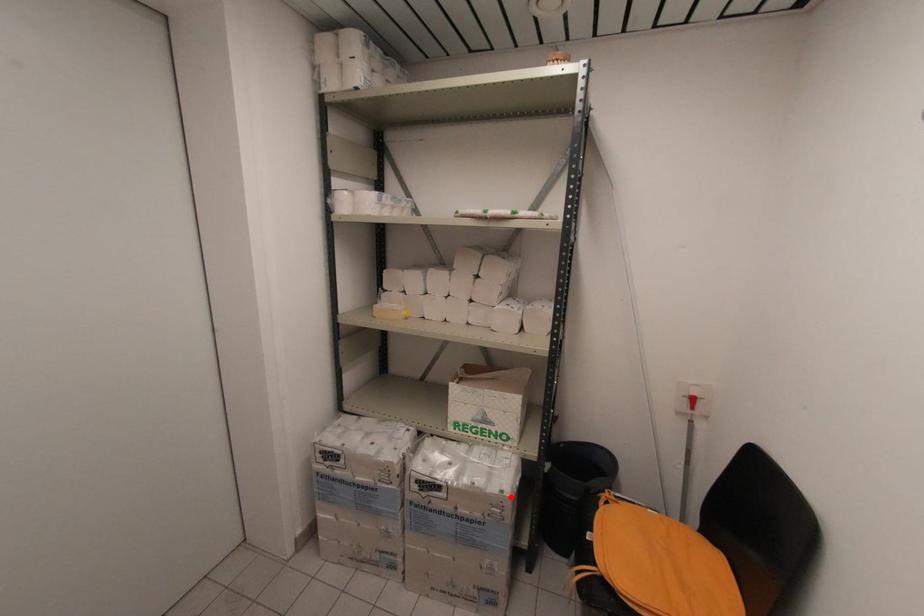
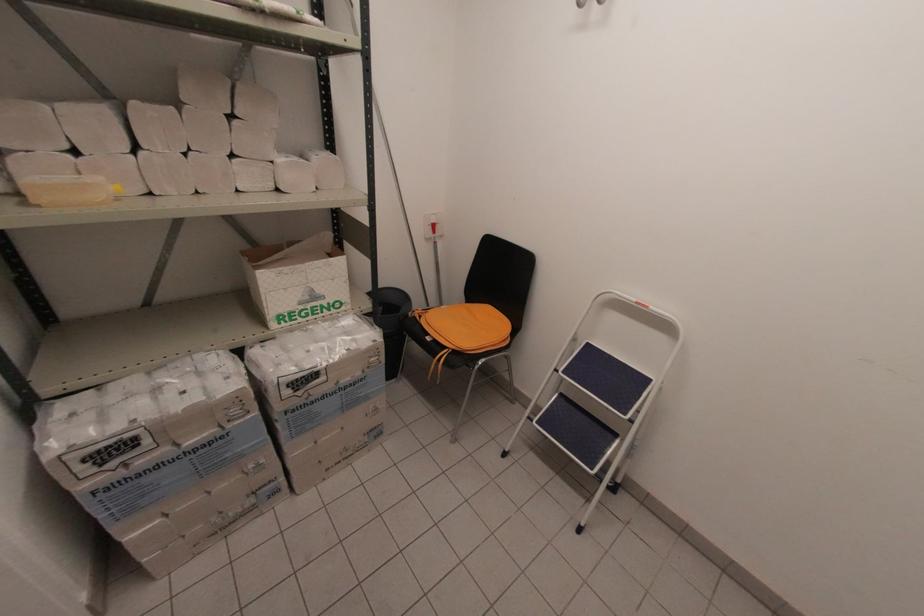
Question: I am providing you with two images of the same scene from different viewpoints. Image1 has a red point marked. In image2, the corresponding 3D location appears at what relative position? Reply with the corresponding letter.

Choices:
 (A) Closer
 (B) Farther

Answer: (A)